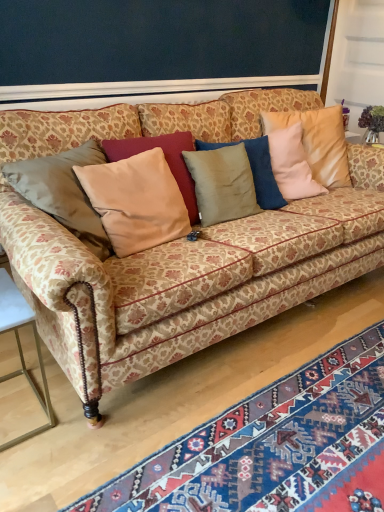
What do you see at coordinates (165, 158) in the screenshot? This screenshot has height=512, width=384. I see `beige velvet pillow at center, placed as the second pillow when sorted from right to left` at bounding box center [165, 158].

This screenshot has width=384, height=512. I want to click on blue woven rug at lower right, so click(274, 446).

This screenshot has height=512, width=384. What do you see at coordinates (21, 347) in the screenshot?
I see `gold metallic table at lower left` at bounding box center [21, 347].

At what (x,y) coordinates should I click in order to perform the action: click on gold metallic table at lower left. Please return your answer as a coordinate pair (x, y). Looking at the image, I should click on (21, 347).

The width and height of the screenshot is (384, 512). Describe the element at coordinates (317, 141) in the screenshot. I see `satin beige pillow at center, arranged as the 1th pillow when viewed from the right` at that location.

Find the location of `beige velvet pillow at center, placed as the second pillow when sorted from right to left`. beige velvet pillow at center, placed as the second pillow when sorted from right to left is located at coordinates (165, 158).

At what (x,y) coordinates should I click in order to perform the action: click on pillow that is the 2nd object above the gold metallic table at lower left (from a real-world perspective). Please return your answer as a coordinate pair (x, y). This screenshot has height=512, width=384. Looking at the image, I should click on pyautogui.click(x=165, y=158).

Considering the sizes of beige velvet pillow at center, which ranks as the 1th pillow in left-to-right order, and gold metallic table at lower left in the image, is beige velvet pillow at center, which ranks as the 1th pillow in left-to-right order, bigger or smaller than gold metallic table at lower left?

Considering their sizes, beige velvet pillow at center, which ranks as the 1th pillow in left-to-right order, takes up less space than gold metallic table at lower left.

From a real-world perspective, is beige velvet pillow at center, which ranks as the 1th pillow in left-to-right order, positioned above or below gold metallic table at lower left?

beige velvet pillow at center, which ranks as the 1th pillow in left-to-right order, is situated higher than gold metallic table at lower left in the real world.

Would you consider beige velvet pillow at center, which ranks as the 1th pillow in left-to-right order, to be distant from gold metallic table at lower left?

beige velvet pillow at center, which ranks as the 1th pillow in left-to-right order, is near gold metallic table at lower left, not far away.

Is patterned fabric couch at center positioned with its back to gold metallic table at lower left?

No, gold metallic table at lower left is not at the back of patterned fabric couch at center.

The image size is (384, 512). Identify the location of studio couch lying above the gold metallic table at lower left (from the image's perspective). (188, 278).

Which object is closer to the camera taking this photo, patterned fabric couch at center or gold metallic table at lower left?

Positioned in front is patterned fabric couch at center.

Looking at this image, is patterned fabric couch at center shorter than gold metallic table at lower left?

Incorrect, the height of patterned fabric couch at center does not fall short of that of gold metallic table at lower left.

Is patterned fabric couch at center taller or shorter than satin beige pillow at center, arranged as the 1th pillow when viewed from the right?

Considering their sizes, patterned fabric couch at center has more height than satin beige pillow at center, arranged as the 1th pillow when viewed from the right.

From a real-world perspective, who is located lower, patterned fabric couch at center or satin beige pillow at center, which is the second pillow in left-to-right order?

patterned fabric couch at center is physically lower.

Is patterned fabric couch at center to the right of satin beige pillow at center, arranged as the 1th pillow when viewed from the right, from the viewer's perspective?

No.

Can you tell me how much patterned fabric couch at center and satin beige pillow at center, which is the second pillow in left-to-right order, differ in facing direction?

19.8 degrees separate the facing orientations of patterned fabric couch at center and satin beige pillow at center, which is the second pillow in left-to-right order.

Based on the photo, considering the sizes of objects satin beige pillow at center, which is the second pillow in left-to-right order, and blue woven rug at lower right in the image provided, who is bigger, satin beige pillow at center, which is the second pillow in left-to-right order, or blue woven rug at lower right?

Bigger between the two is blue woven rug at lower right.

From the picture: Is satin beige pillow at center, which is the second pillow in left-to-right order, thinner than blue woven rug at lower right?

Correct, the width of satin beige pillow at center, which is the second pillow in left-to-right order, is less than that of blue woven rug at lower right.

From the image's perspective, would you say satin beige pillow at center, arranged as the 1th pillow when viewed from the right, is positioned over blue woven rug at lower right?

Yes, from the image's perspective, satin beige pillow at center, arranged as the 1th pillow when viewed from the right, is above blue woven rug at lower right.

From the picture: In the image, is satin beige pillow at center, arranged as the 1th pillow when viewed from the right, on the left side or the right side of blue woven rug at lower right?

satin beige pillow at center, arranged as the 1th pillow when viewed from the right, is positioned on blue woven rug at lower right's right side.

Can you confirm if blue woven rug at lower right is thinner than satin beige pillow at center, arranged as the 1th pillow when viewed from the right?

No.

At what (x,y) coordinates should I click in order to perform the action: click on pillow that is the 2nd object located behind the blue woven rug at lower right. Please return your answer as a coordinate pair (x, y). Looking at the image, I should click on (317, 141).

Which is in front, point (380, 450) or point (317, 133)?

The point (380, 450) is more forward.

Is blue woven rug at lower right to the left or to the right of satin beige pillow at center, arranged as the 1th pillow when viewed from the right, in the image?

Based on their positions, blue woven rug at lower right is located to the left of satin beige pillow at center, arranged as the 1th pillow when viewed from the right.

Considering the relative sizes of blue woven rug at lower right and patterned fabric couch at center in the image provided, is blue woven rug at lower right taller than patterned fabric couch at center?

In fact, blue woven rug at lower right may be shorter than patterned fabric couch at center.

Can patterned fabric couch at center be found inside blue woven rug at lower right?

No, patterned fabric couch at center is not surrounded by blue woven rug at lower right.

Which is closer to the camera, [364,374] or [207,297]?

Point [207,297]

From a real-world perspective, does blue woven rug at lower right stand above patterned fabric couch at center?

No, from a real-world perspective, blue woven rug at lower right is not on top of patterned fabric couch at center.

Considering the sizes of patterned fabric couch at center and blue woven rug at lower right in the image, is patterned fabric couch at center bigger or smaller than blue woven rug at lower right?

In the image, patterned fabric couch at center appears to be larger than blue woven rug at lower right.

From the image's perspective, which object appears higher, patterned fabric couch at center or blue woven rug at lower right?

patterned fabric couch at center is shown above in the image.

From a real-world perspective, is patterned fabric couch at center over blue woven rug at lower right?

Yes, from a real-world perspective, patterned fabric couch at center is over blue woven rug at lower right

Between patterned fabric couch at center and blue woven rug at lower right, which one has larger width?

Wider between the two is patterned fabric couch at center.

The width and height of the screenshot is (384, 512). I want to click on table directly beneath the beige velvet pillow at center, which ranks as the 1th pillow in left-to-right order (from a real-world perspective), so click(x=21, y=347).

Where is `table behind the patterned fabric couch at center`? The height and width of the screenshot is (512, 384). table behind the patterned fabric couch at center is located at coordinates (21, 347).

Which object lies nearer to the anchor point patterned fabric couch at center, beige velvet pillow at center, placed as the second pillow when sorted from right to left, or blue woven rug at lower right?

The object closer to patterned fabric couch at center is beige velvet pillow at center, placed as the second pillow when sorted from right to left.

Estimate the real-world distances between objects in this image. Which object is closer to blue woven rug at lower right, patterned fabric couch at center or beige velvet pillow at center, which ranks as the 1th pillow in left-to-right order?

patterned fabric couch at center is closer to blue woven rug at lower right.

Which object lies further to the anchor point beige velvet pillow at center, which ranks as the 1th pillow in left-to-right order, satin beige pillow at center, which is the second pillow in left-to-right order, or gold metallic table at lower left?

Based on the image, gold metallic table at lower left appears to be further to beige velvet pillow at center, which ranks as the 1th pillow in left-to-right order.

Which object lies further to the anchor point satin beige pillow at center, arranged as the 1th pillow when viewed from the right, patterned fabric couch at center or beige velvet pillow at center, placed as the second pillow when sorted from right to left?

Among the two, beige velvet pillow at center, placed as the second pillow when sorted from right to left, is located further to satin beige pillow at center, arranged as the 1th pillow when viewed from the right.

Based on their spatial positions, is beige velvet pillow at center, which ranks as the 1th pillow in left-to-right order, or satin beige pillow at center, which is the second pillow in left-to-right order, further from blue woven rug at lower right?

Based on the image, satin beige pillow at center, which is the second pillow in left-to-right order, appears to be further to blue woven rug at lower right.

From the image, which object appears to be farther from patterned fabric couch at center, blue woven rug at lower right or beige velvet pillow at center, placed as the second pillow when sorted from right to left?

blue woven rug at lower right lies further to patterned fabric couch at center than the other object.

Estimate the real-world distances between objects in this image. Which object is further from beige velvet pillow at center, placed as the second pillow when sorted from right to left, blue woven rug at lower right or satin beige pillow at center, arranged as the 1th pillow when viewed from the right?

blue woven rug at lower right lies further to beige velvet pillow at center, placed as the second pillow when sorted from right to left, than the other object.

Based on their spatial positions, is satin beige pillow at center, which is the second pillow in left-to-right order, or beige velvet pillow at center, placed as the second pillow when sorted from right to left, closer to blue woven rug at lower right?

beige velvet pillow at center, placed as the second pillow when sorted from right to left, is closer to blue woven rug at lower right.

Locate an element on the screen. studio couch between gold metallic table at lower left and satin beige pillow at center, arranged as the 1th pillow when viewed from the right is located at coordinates (188, 278).

In order to click on pillow between gold metallic table at lower left and satin beige pillow at center, arranged as the 1th pillow when viewed from the right, in the horizontal direction in this screenshot , I will do `click(165, 158)`.

Where is `pillow between satin beige pillow at center, which is the second pillow in left-to-right order, and blue woven rug at lower right, in the vertical direction`? The width and height of the screenshot is (384, 512). pillow between satin beige pillow at center, which is the second pillow in left-to-right order, and blue woven rug at lower right, in the vertical direction is located at coordinates (165, 158).

What are the coordinates of `table between blue woven rug at lower right and satin beige pillow at center, which is the second pillow in left-to-right order, along the z-axis` in the screenshot? It's located at (21, 347).